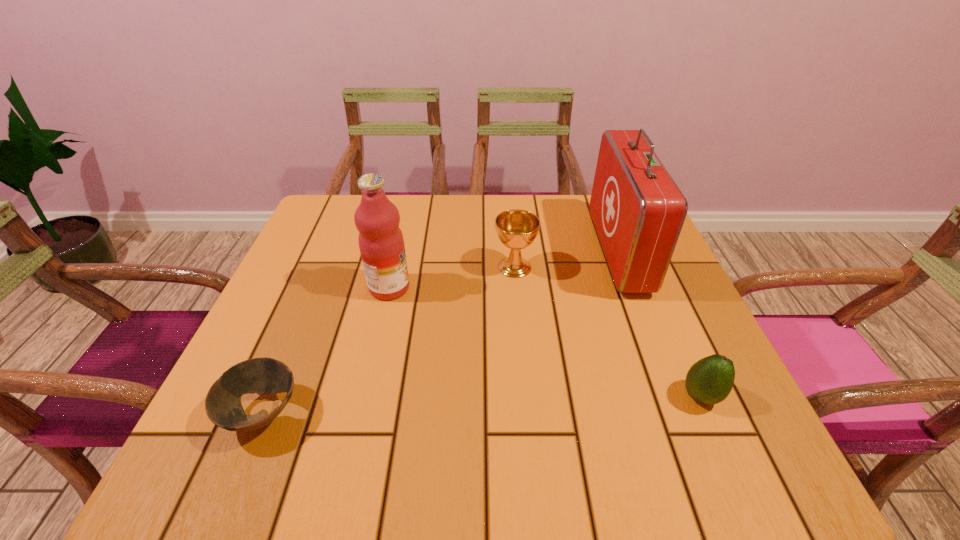
Image resolution: width=960 pixels, height=540 pixels. What are the coordinates of `free space that is in between the chalice and the first-aid kit` in the screenshot? It's located at pos(566,259).

Locate an element on the screen. free area in between the first-aid kit and the fourth tallest object is located at coordinates (660, 324).

Identify the location of vacant area that lies between the bowl and the fruit juice. This screenshot has height=540, width=960. (326, 350).

Identify the location of free point between the third object from left to right and the shortest object. (389, 340).

At what (x,y) coordinates should I click in order to perform the action: click on empty space that is in between the first-aid kit and the fourth tallest object. Please return your answer as a coordinate pair (x, y). This screenshot has height=540, width=960. Looking at the image, I should click on (660, 324).

Select which object is the third closest to the second shortest object. Please provide its 2D coordinates. Your answer should be formatted as a tuple, i.e. [(x, y)], where the tuple contains the x and y coordinates of a point satisfying the conditions above.

[(381, 243)]

Where is `object that is the nearest to the second object from left to right`? object that is the nearest to the second object from left to right is located at coordinates (517, 229).

You are a GUI agent. You are given a task and a screenshot of the screen. Output one action in this format:
    pyautogui.click(x=<x>, y=<y>)
    Task: Click on the free space that satisfies the following two spatial constraints: 1. on the side of the first-aid kit with the first aid cross symbol; 2. on the right side of the fourth tallest object
    The height and width of the screenshot is (540, 960).
    Given the screenshot: What is the action you would take?
    pyautogui.click(x=675, y=396)

Identify the location of vacant space that satisfies the following two spatial constraints: 1. on the side of the first-aid kit with the first aid cross symbol; 2. on the left side of the second shortest object. This screenshot has width=960, height=540. (675, 396).

Identify the location of vacant space that satisfies the following two spatial constraints: 1. on the label of the fruit juice; 2. on the back side of the avocado. (365, 396).